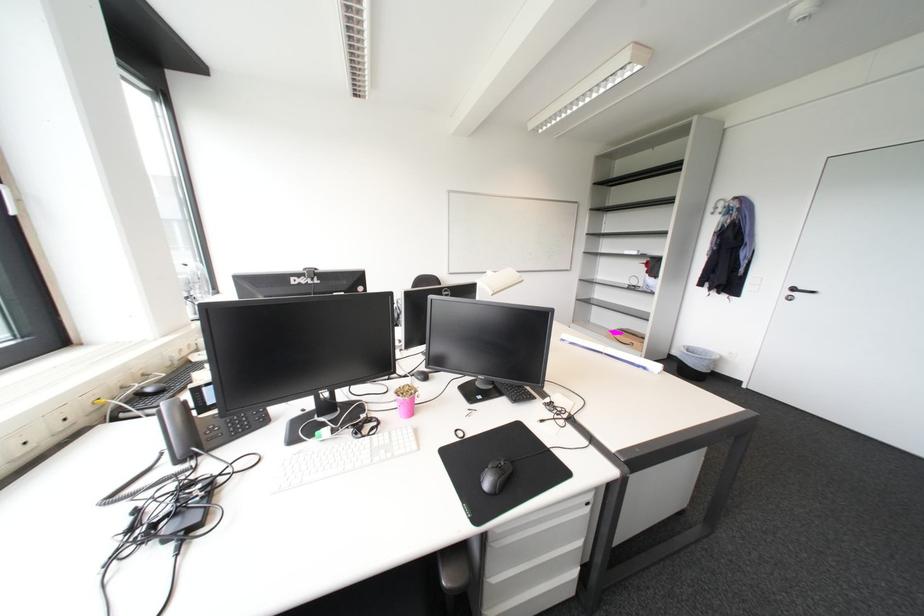
This screenshot has height=616, width=924. Identify the location of black door handle. (801, 291).